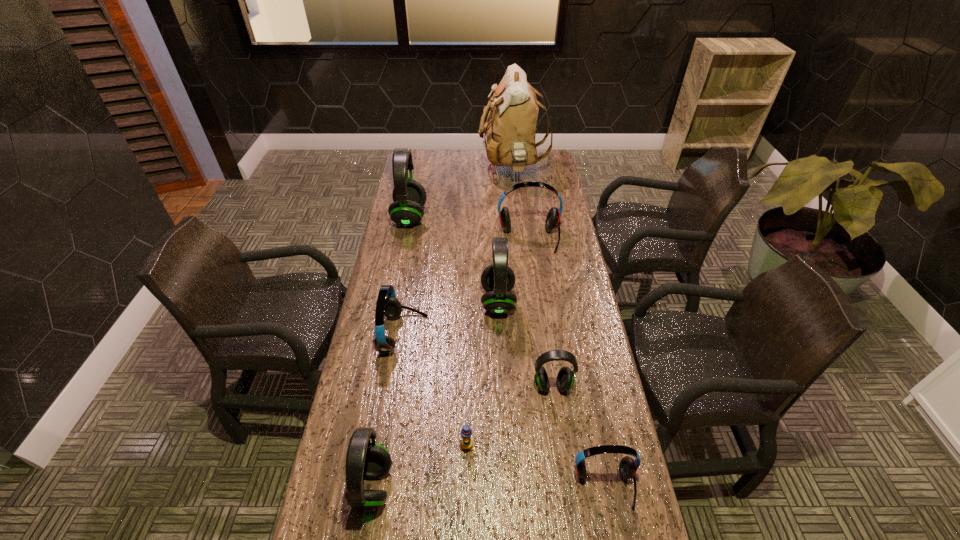
This screenshot has height=540, width=960. I want to click on the sixth farthest object, so click(x=565, y=379).

I want to click on the smallest black headset, so click(565, 379).

I want to click on the smallest red headset, so click(x=627, y=468).

At what (x,y) coordinates should I click in order to perform the action: click on yellow duckling. Please return your answer as a coordinate pair (x, y). The height and width of the screenshot is (540, 960). Looking at the image, I should click on (466, 442).

I want to click on the sixth object from right to left, so tap(466, 442).

Identify the location of vacant area situated 0.190m on the front-facing side of the backpack. (440, 170).

Find the location of a particular element. blank space located on the front-facing side of the backpack is located at coordinates (447, 170).

The width and height of the screenshot is (960, 540). Identify the location of vacant region located 0.170m on the front-facing side of the backpack. (444, 170).

The image size is (960, 540). Find the location of `vacant space located on the ear cups of the biggest black headset`. vacant space located on the ear cups of the biggest black headset is located at coordinates (441, 217).

The width and height of the screenshot is (960, 540). In order to click on vacant space situated 0.260m on the ear cups of the second farthest black headset in this screenshot , I will do `click(406, 301)`.